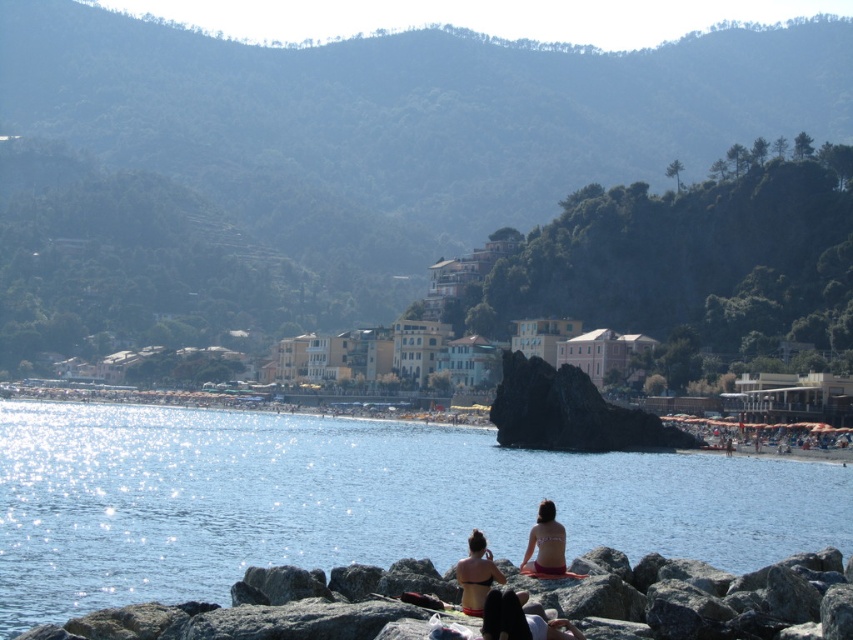
You are a photographer trying to capture a photo of the matte black bikini top at center and the beige bikini at lower center. Based on their positions, which one would appear closer to the camera in the photo?

The beige bikini at lower center would appear closer to the camera because it is positioned lower in the scene compared to the matte black bikini top at center, which is taller and thus farther away.

You are a photographer aiming to capture a shot of the blue water at center and the matte black bikini top at center. Based on their positions, which object would appear closer to the camera in the photo?

The blue water at center appears closer to the camera because it is taller than the matte black bikini top at center in the image.

You are standing at the point marked by the coordinates point (349, 500) in the coastal scene. What is the immediate environment around you like?

The point (349, 500) marks blue water at center, so the immediate environment around you is blue water at center.